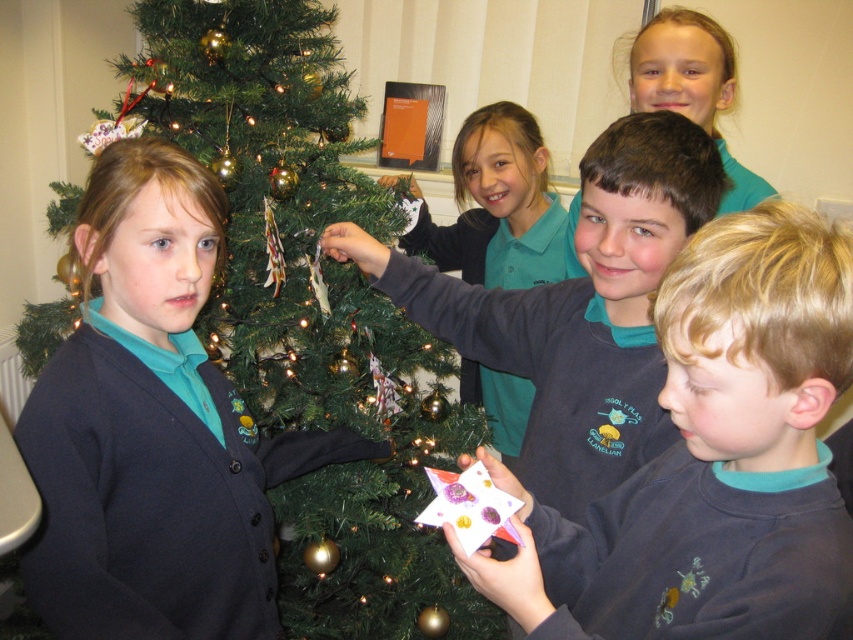
You are standing in the room where the children are decorating the Christmas tree. There are two points marked in the image. Point A is at coordinates point (467,348) and Point B is at coordinates point (741,193). If you want to place a gift under the tree, which point should you choose to ensure it is closer to the tree?

Point A at coordinates point (467,348) is closer to the tree because it is in front of point B at coordinates point (741,193).

Looking at the children in the scene, which clothing item is positioned to the left of the other between the matte gray sweater at center and the teal fabric shirt at upper center?

The matte gray sweater at center is positioned to the left of the teal fabric shirt at upper center.